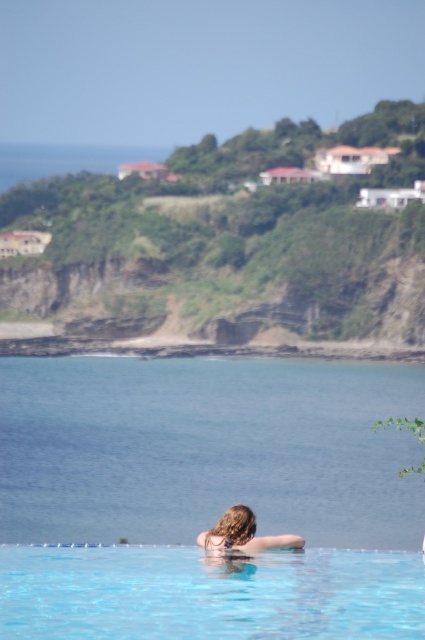
You are standing at the edge of the infinity pool and see the transparent blue water at center and the blonde hair at upper center. Which object is located to the left of the other?

The transparent blue water at center is positioned on the left side of blonde hair at upper center.

You are a photographer trying to capture the reflection of the blonde hair at upper center in the clear glass pool at center. Based on the scene, will the reflection be visible in the pool?

The clear glass pool at center is positioned under the blonde hair at upper center, so the reflection of the blonde hair at upper center should be visible in the clear glass pool at center.